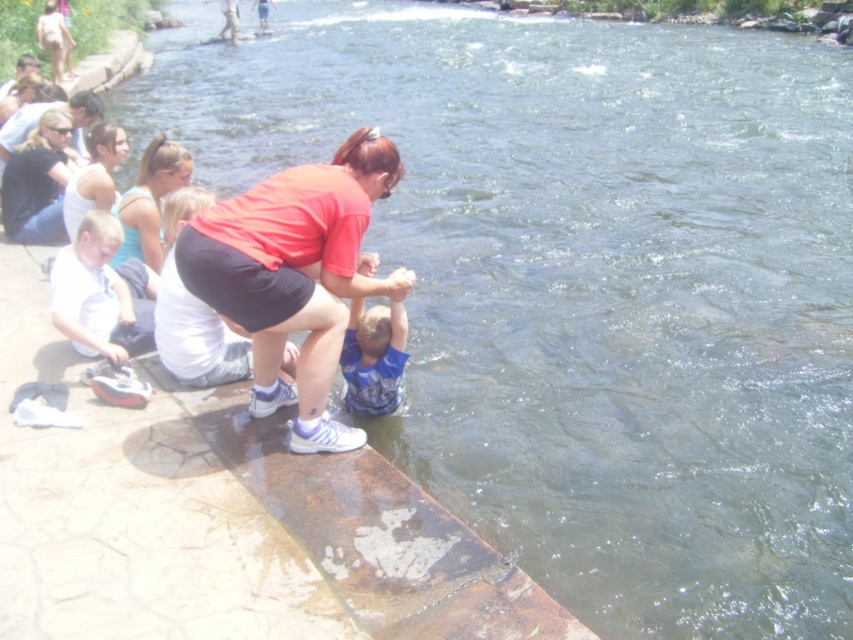
Question: Estimate the real-world distances between objects in this image. Which object is closer to the matte blue tank top at upper left?

Choices:
 (A) matte white tank top at upper left
 (B) matte black shorts at center
 (C) white cotton shirt at left

Answer: (C)

Question: Which of the following is the farthest from the observer?

Choices:
 (A) click(x=171, y=156)
 (B) click(x=149, y=296)
 (C) click(x=78, y=189)
 (D) click(x=358, y=358)

Answer: (C)

Question: Is matte red shirt at center thinner than blue cotton shirt at center?

Choices:
 (A) no
 (B) yes

Answer: (A)

Question: Which of the following is the closest to the observer?

Choices:
 (A) white cotton shirt at left
 (B) blue cotton shirt at center
 (C) matte white tank top at upper left

Answer: (B)

Question: Can you confirm if blue cotton shirt at center is bigger than matte blue tank top at upper left?

Choices:
 (A) yes
 (B) no

Answer: (B)

Question: Does matte blue tank top at upper left appear over matte white tank top at upper left?

Choices:
 (A) yes
 (B) no

Answer: (B)